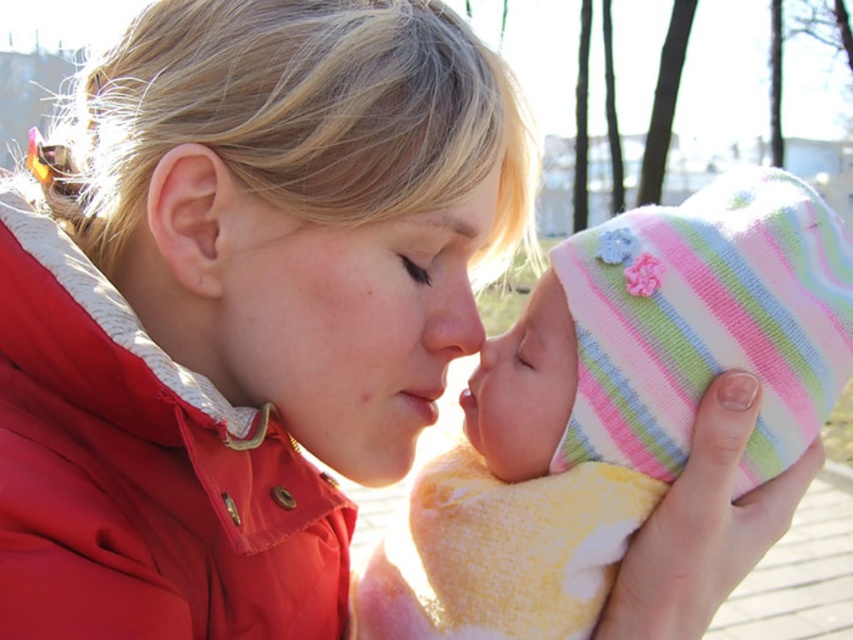
Question: Which point is farther to the camera?

Choices:
 (A) (79, 348)
 (B) (450, 214)

Answer: (B)

Question: Is smooth skin face at center to the right of matte skin forehead at upper center from the viewer's perspective?

Choices:
 (A) yes
 (B) no

Answer: (B)

Question: Is smooth pink baby face at center in front of matte skin forehead at upper center?

Choices:
 (A) yes
 (B) no

Answer: (B)

Question: Estimate the real-world distances between objects in this image. Which object is farther from the matte skin forehead at upper center?

Choices:
 (A) pastel striped knit hat at center
 (B) red quilted jacket at center
 (C) smooth pink baby face at center

Answer: (B)

Question: Which point is farther from the camera taking this photo?

Choices:
 (A) (48, 349)
 (B) (445, 232)
 (C) (498, 460)
 (D) (390, 540)

Answer: (D)

Question: Is pastel striped knit hat at center smaller than smooth pink baby face at center?

Choices:
 (A) yes
 (B) no

Answer: (B)